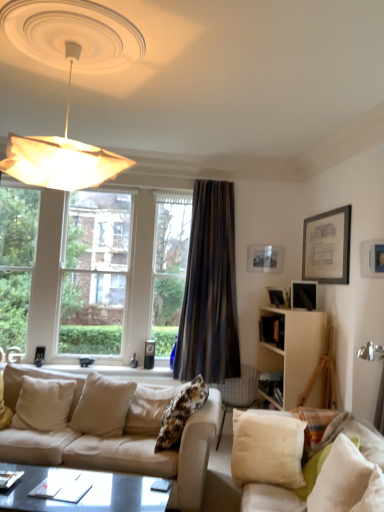
Question: Are white fabric lampshade at upper left and beige fabric couch at lower left, positioned as the second studio couch in right-to-left order, far apart?

Choices:
 (A) yes
 (B) no

Answer: (A)

Question: Is white fabric lampshade at upper left positioned in front of beige fabric couch at lower left, which appears as the first studio couch when viewed from the left?

Choices:
 (A) no
 (B) yes

Answer: (B)

Question: Is white fabric lampshade at upper left bigger than beige fabric couch at lower left, positioned as the second studio couch in right-to-left order?

Choices:
 (A) yes
 (B) no

Answer: (B)

Question: Is white fabric lampshade at upper left facing away from beige fabric couch at lower left, positioned as the second studio couch in right-to-left order?

Choices:
 (A) no
 (B) yes

Answer: (A)

Question: From a real-world perspective, is white fabric lampshade at upper left under beige fabric couch at lower left, positioned as the second studio couch in right-to-left order?

Choices:
 (A) yes
 (B) no

Answer: (B)

Question: From a real-world perspective, relative to white fabric pillow at center, placed as the 4th pillow when sorted from right to left, is white soft pillow at lower right, the 5th pillow when ordered from left to right, vertically above or below?

Choices:
 (A) below
 (B) above

Answer: (A)

Question: Considering the positions of white soft pillow at lower right, the 5th pillow when ordered from left to right, and white fabric pillow at center, placed as the 4th pillow when sorted from right to left, in the image, is white soft pillow at lower right, the 5th pillow when ordered from left to right, taller or shorter than white fabric pillow at center, placed as the 4th pillow when sorted from right to left,?

Choices:
 (A) tall
 (B) short

Answer: (B)

Question: In the image, is white soft pillow at lower right, the 5th pillow when ordered from left to right, positioned in front of or behind white fabric pillow at center, placed as the 4th pillow when sorted from right to left?

Choices:
 (A) front
 (B) behind

Answer: (A)

Question: From the image's perspective, is white soft pillow at lower right, the 5th pillow when ordered from left to right, positioned above or below white fabric pillow at center, placed as the 4th pillow when sorted from right to left?

Choices:
 (A) above
 (B) below

Answer: (B)

Question: In terms of width, does fluffy fabric pillow at center, the 3th pillow in the right-to-left sequence, look wider or thinner when compared to matte black picture frame at upper right, which is counted as the first picture frame, starting from the back?

Choices:
 (A) thin
 (B) wide

Answer: (B)

Question: In the image, is fluffy fabric pillow at center, placed as the 3th pillow when sorted from left to right, on the left side or the right side of matte black picture frame at upper right, marked as the 4th picture frame in a front-to-back arrangement?

Choices:
 (A) right
 (B) left

Answer: (B)

Question: Considering their positions, is fluffy fabric pillow at center, placed as the 3th pillow when sorted from left to right, located in front of or behind matte black picture frame at upper right, which is counted as the first picture frame, starting from the back?

Choices:
 (A) front
 (B) behind

Answer: (A)

Question: Considering the positions of point (165, 422) and point (283, 250), is point (165, 422) closer or farther from the camera than point (283, 250)?

Choices:
 (A) farther
 (B) closer

Answer: (B)

Question: In the image, is white cotton pillow at lower right, which ranks as the 2th pillow in right-to-left order, on the left side or the right side of matte black coffee table at lower center?

Choices:
 (A) left
 (B) right

Answer: (B)

Question: Is point (284, 463) closer or farther from the camera than point (117, 508)?

Choices:
 (A) farther
 (B) closer

Answer: (A)